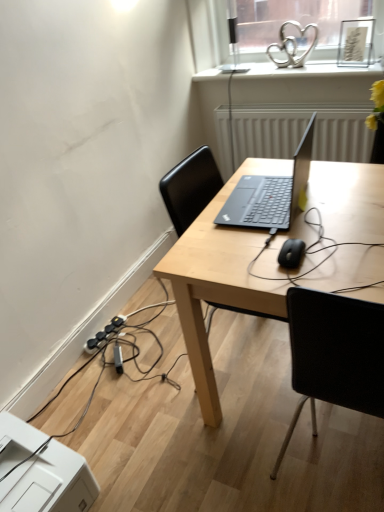
At what (x,y) coordinates should I click in order to perform the action: click on vacant space in front of sleek silver laptop at center. Please return your answer as a coordinate pair (x, y). Looking at the image, I should click on (303, 243).